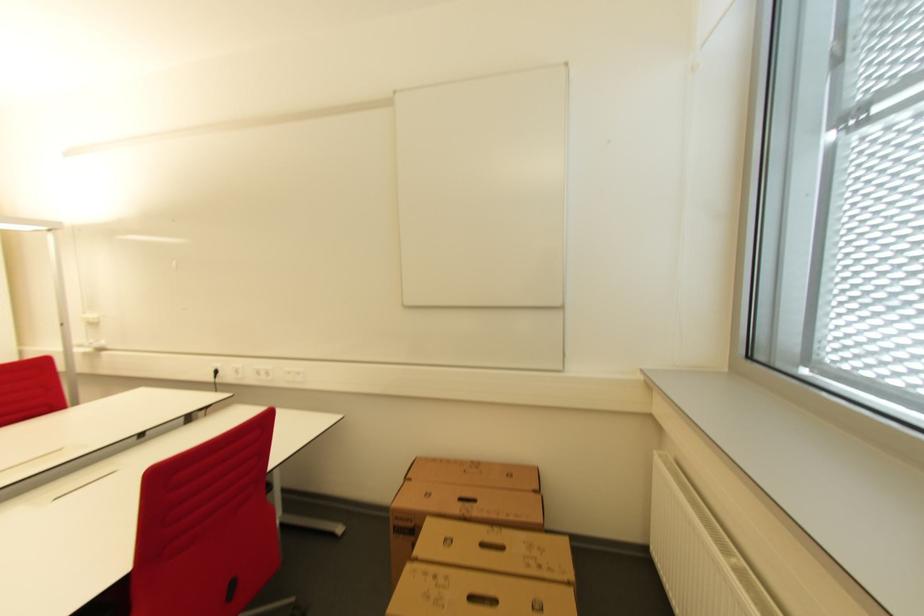
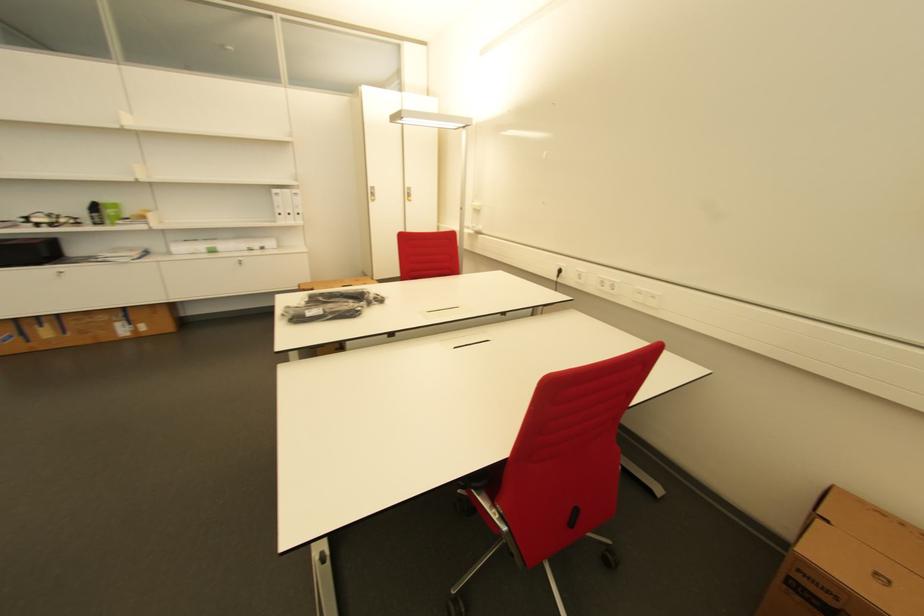
Where in the second image is the point corresponding to [269,377] from the first image?

(612, 289)